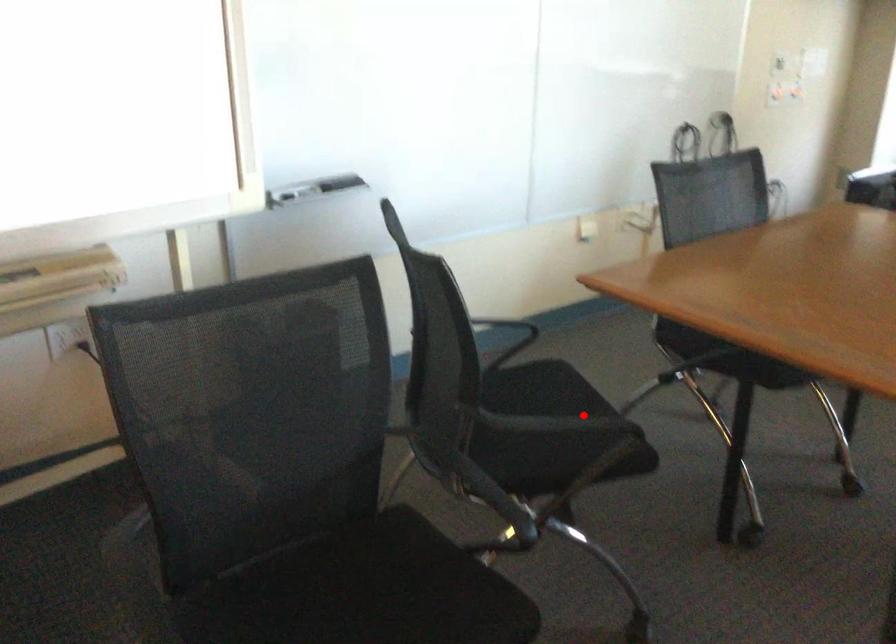
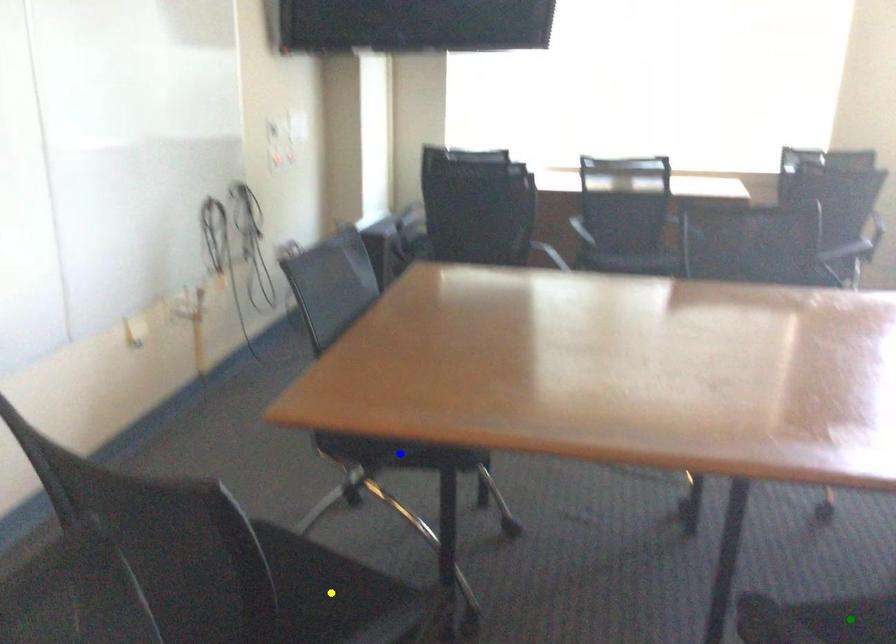
Question: I am providing you with two images of the same scene from different viewpoints. A red point is marked on the first image. You are given multiple points on the second image. Which point in image 2 represents the same 3d spot as the red point in image 1?

Choices:
 (A) blue point
 (B) yellow point
 (C) green point

Answer: (B)